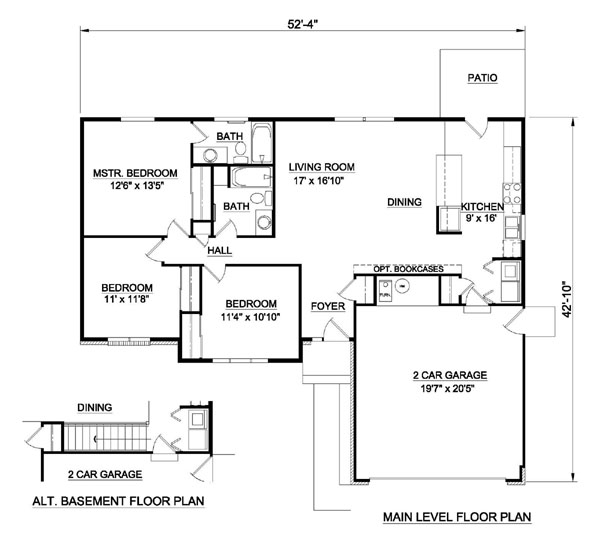
I want to click on bedroom next to master bedroom, so click(131, 268).